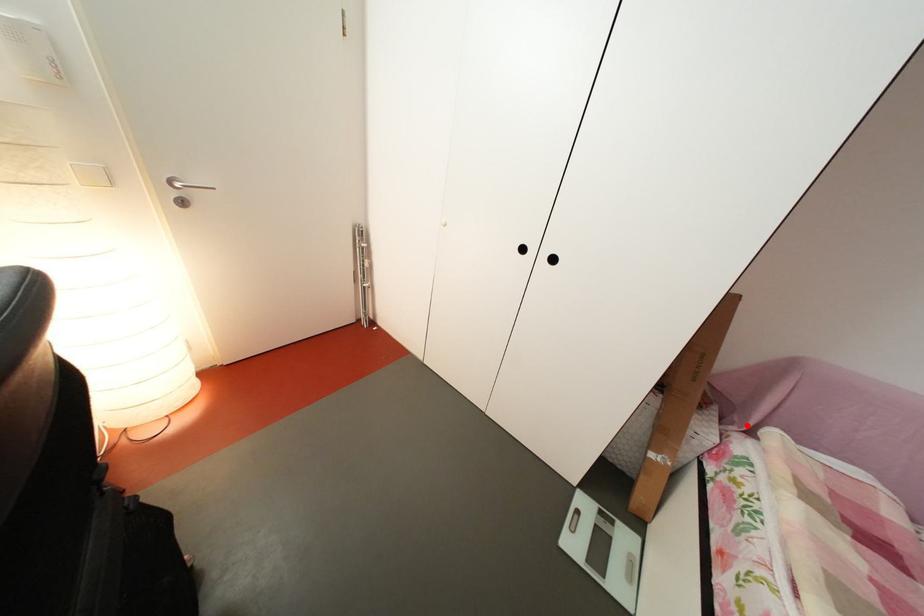
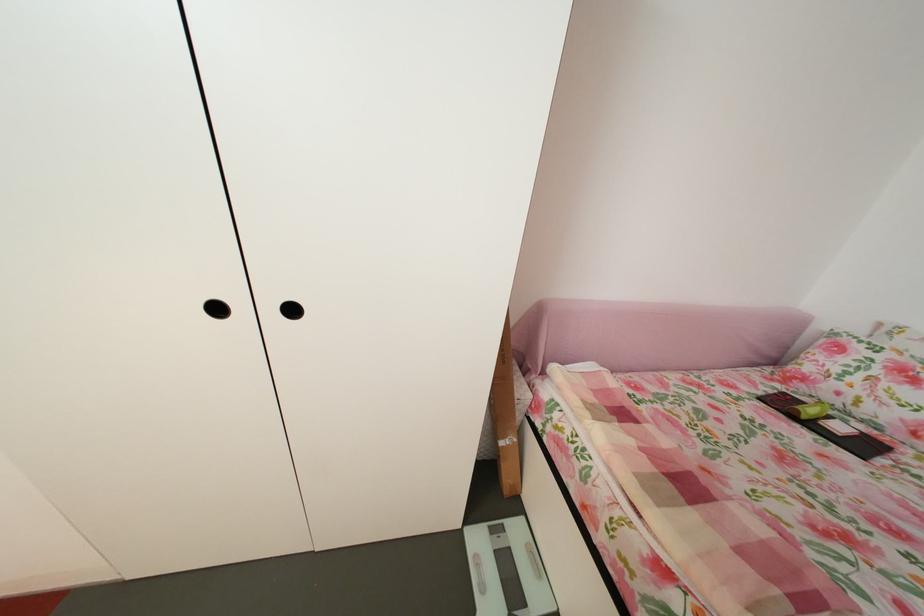
Question: I am providing you with two images of the same scene from different viewpoints. Image1 has a red point marked. In image2, the corresponding 3D location appears at what relative position? Reply with the corresponding letter.

Choices:
 (A) Closer
 (B) Farther

Answer: (B)